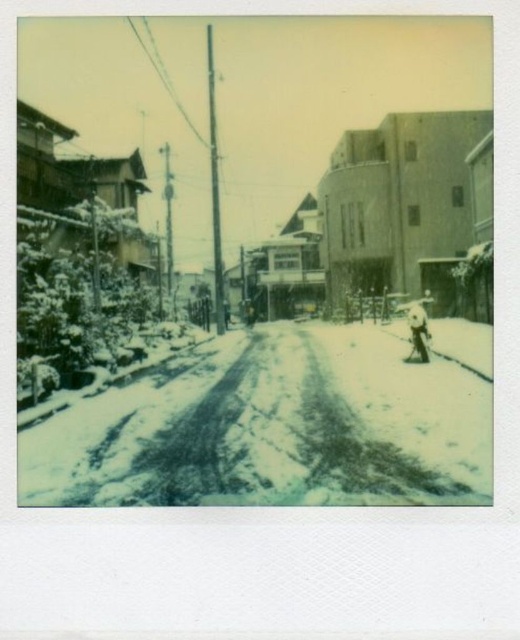
Is white snow at center thinner than white powdery snow at center?

No, white snow at center is not thinner than white powdery snow at center.

Measure the distance between white snow at center and white powdery snow at center.

white snow at center is 670.50 feet from white powdery snow at center.

What do you see at coordinates (265, 260) in the screenshot?
I see `white snow at center` at bounding box center [265, 260].

Locate an element on the screen. white snow at center is located at coordinates (265, 260).